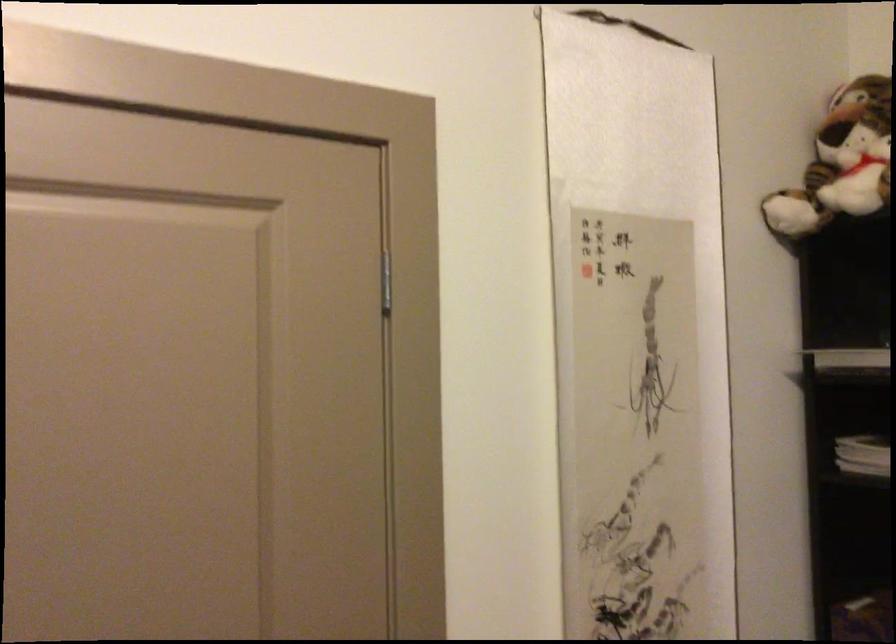
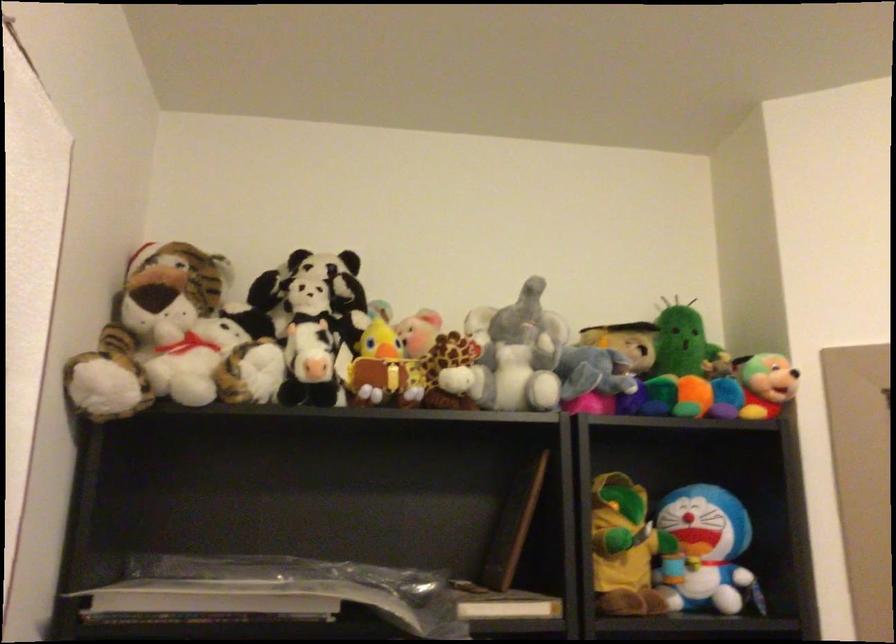
The images are taken continuously from a first-person perspective. In which direction is your viewpoint rotating?

The camera rotated toward right-up.